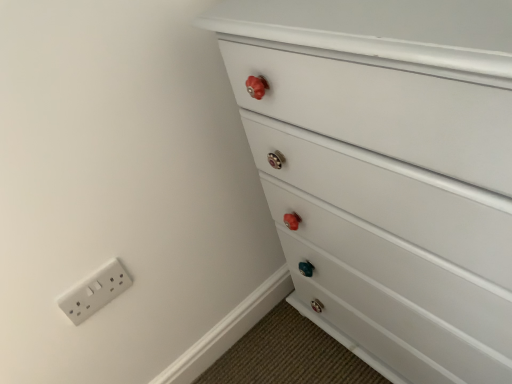
The width and height of the screenshot is (512, 384). What do you see at coordinates (387, 171) in the screenshot?
I see `white glossy chest of drawers at upper right` at bounding box center [387, 171].

Identify the location of white glossy chest of drawers at upper right. This screenshot has height=384, width=512. (387, 171).

Where is `white glossy chest of drawers at upper right`? The width and height of the screenshot is (512, 384). white glossy chest of drawers at upper right is located at coordinates pos(387,171).